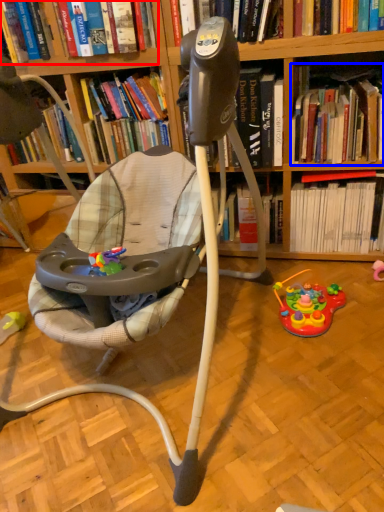
Question: Which point is closer to the camera, book (highlighted by a red box) or book (highlighted by a blue box)?

Choices:
 (A) book
 (B) book

Answer: (A)